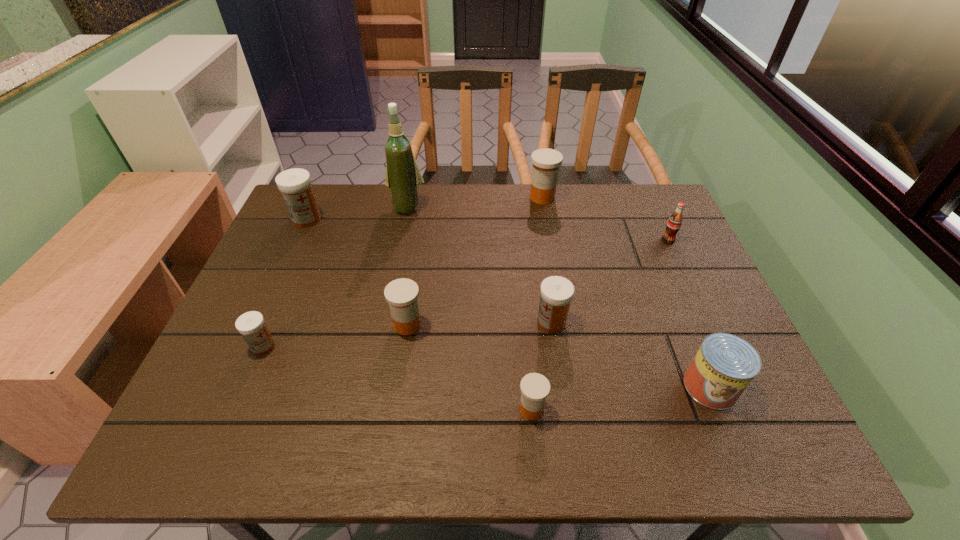
Where is `free space at the right edge of the desktop`? Image resolution: width=960 pixels, height=540 pixels. free space at the right edge of the desktop is located at coordinates (682, 253).

Locate an element on the screen. This screenshot has width=960, height=540. vacant space in between the second biggest white medicine and the rightmost orange medicine is located at coordinates (547, 260).

Where is `vacant area between the soda and the third medicine from right to left`? The image size is (960, 540). vacant area between the soda and the third medicine from right to left is located at coordinates pyautogui.click(x=600, y=325).

Identify the location of vacant area between the farthest medicine and the leftmost orange medicine. (475, 261).

Locate an element on the screen. Image resolution: width=960 pixels, height=540 pixels. free space between the second nearest white medicine and the can is located at coordinates (631, 354).

The width and height of the screenshot is (960, 540). I want to click on free spot between the nearest white medicine and the can, so click(x=487, y=366).

At what (x,y) coordinates should I click in order to perform the action: click on vacant area that lies between the second nearest orange medicine and the second farthest white medicine. Please return your answer as a coordinate pair (x, y). Looking at the image, I should click on (480, 323).

At what (x,y) coordinates should I click in order to perform the action: click on unoccupied position between the nearest orange medicine and the tallest object. Please return your answer as a coordinate pair (x, y). This screenshot has width=960, height=540. Looking at the image, I should click on coord(469,308).

This screenshot has height=540, width=960. What are the coordinates of `vacant area between the sixth nearest object and the second orange medicine from right to left` in the screenshot? It's located at (600, 325).

Locate an element on the screen. free space between the fifth nearest medicine and the can is located at coordinates (509, 303).